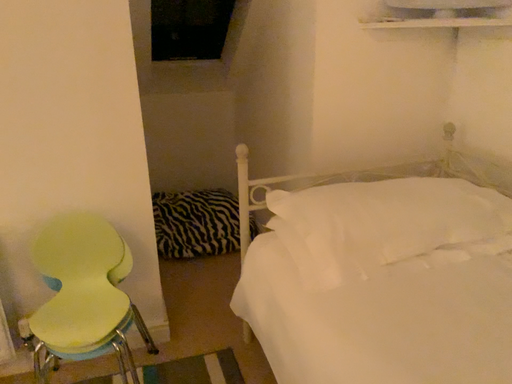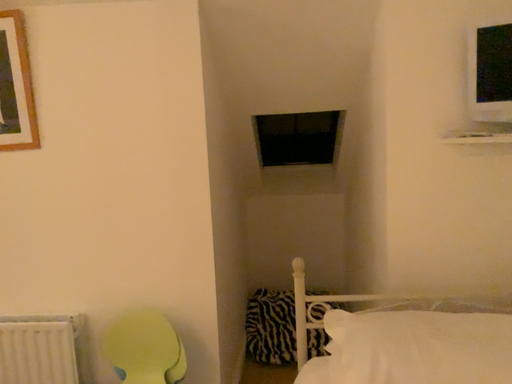
Question: How did the camera likely rotate when shooting the video?

Choices:
 (A) rotated upward
 (B) rotated downward

Answer: (A)